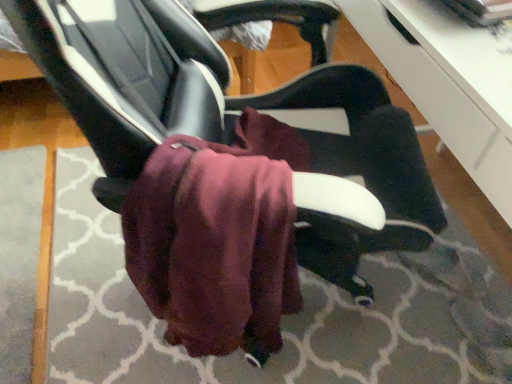
Question: Is maroon fabric at center smaller than burgundy fleece bath towel at center?

Choices:
 (A) no
 (B) yes

Answer: (A)

Question: From a real-world perspective, is maroon fabric at center located higher than burgundy fleece bath towel at center?

Choices:
 (A) yes
 (B) no

Answer: (B)

Question: From the image's perspective, is maroon fabric at center on top of burgundy fleece bath towel at center?

Choices:
 (A) yes
 (B) no

Answer: (A)

Question: Is maroon fabric at center further to camera compared to burgundy fleece bath towel at center?

Choices:
 (A) no
 (B) yes

Answer: (B)

Question: Does maroon fabric at center have a lesser height compared to burgundy fleece bath towel at center?

Choices:
 (A) yes
 (B) no

Answer: (A)

Question: Is burgundy fleece bath towel at center inside the boundaries of maroon fabric at center, or outside?

Choices:
 (A) outside
 (B) inside

Answer: (A)

Question: From the image's perspective, is burgundy fleece bath towel at center located above or below maroon fabric at center?

Choices:
 (A) below
 (B) above

Answer: (A)

Question: From their relative heights in the image, would you say burgundy fleece bath towel at center is taller or shorter than maroon fabric at center?

Choices:
 (A) short
 (B) tall

Answer: (B)

Question: Considering the positions of burgundy fleece bath towel at center and maroon fabric at center in the image, is burgundy fleece bath towel at center bigger or smaller than maroon fabric at center?

Choices:
 (A) big
 (B) small

Answer: (B)

Question: Considering the positions of matte black chair at center and burgundy fleece bath towel at center in the image, is matte black chair at center wider or thinner than burgundy fleece bath towel at center?

Choices:
 (A) wide
 (B) thin

Answer: (A)

Question: Considering the relative positions of matte black chair at center and burgundy fleece bath towel at center in the image provided, is matte black chair at center to the left or to the right of burgundy fleece bath towel at center?

Choices:
 (A) right
 (B) left

Answer: (A)

Question: From the image's perspective, is matte black chair at center above or below burgundy fleece bath towel at center?

Choices:
 (A) above
 (B) below

Answer: (A)

Question: Considering the positions of point (154, 36) and point (251, 160), is point (154, 36) closer or farther from the camera than point (251, 160)?

Choices:
 (A) farther
 (B) closer

Answer: (A)

Question: Is point (198, 263) closer or farther from the camera than point (355, 205)?

Choices:
 (A) closer
 (B) farther

Answer: (B)

Question: From the image's perspective, relative to matte black chair at center, is burgundy fleece bath towel at center above or below?

Choices:
 (A) above
 (B) below

Answer: (B)